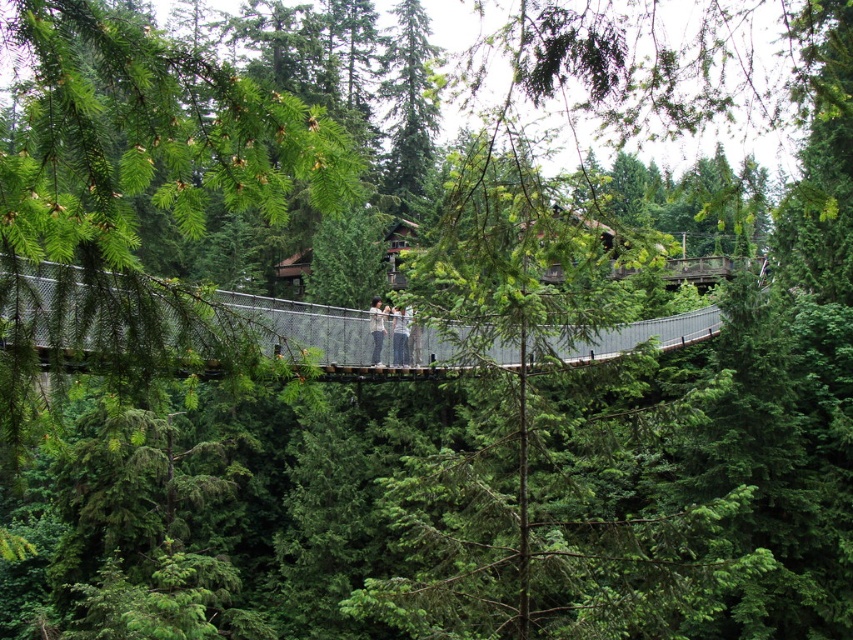
Who is positioned more to the left, metallic gray bridge at center or light gray fabric pants at center?

Positioned to the left is light gray fabric pants at center.

Is metallic gray bridge at center thinner than light gray fabric pants at center?

No.

Who is more forward, (241, 301) or (380, 326)?

Point (241, 301) is in front.

This screenshot has height=640, width=853. Identify the location of metallic gray bridge at center. (57, 307).

Is metallic gray bridge at center positioned at the back of light gray fabric jacket at center?

No.

Locate an element on the screen. The height and width of the screenshot is (640, 853). metallic gray bridge at center is located at coordinates (57, 307).

From the picture: Who is more forward, (316, 344) or (393, 323)?

Point (316, 344) is in front.

Find the location of `metallic gray bridge at center`. metallic gray bridge at center is located at coordinates (57, 307).

Who is positioned more to the right, light gray fabric jacket at center or light gray fabric pants at center?

From the viewer's perspective, light gray fabric jacket at center appears more on the right side.

Does light gray fabric jacket at center have a lesser height compared to light gray fabric pants at center?

Correct, light gray fabric jacket at center is not as tall as light gray fabric pants at center.

Image resolution: width=853 pixels, height=640 pixels. Describe the element at coordinates (399, 336) in the screenshot. I see `light gray fabric jacket at center` at that location.

At what (x,y) coordinates should I click in order to perform the action: click on light gray fabric jacket at center. Please return your answer as a coordinate pair (x, y). This screenshot has height=640, width=853. Looking at the image, I should click on (399, 336).